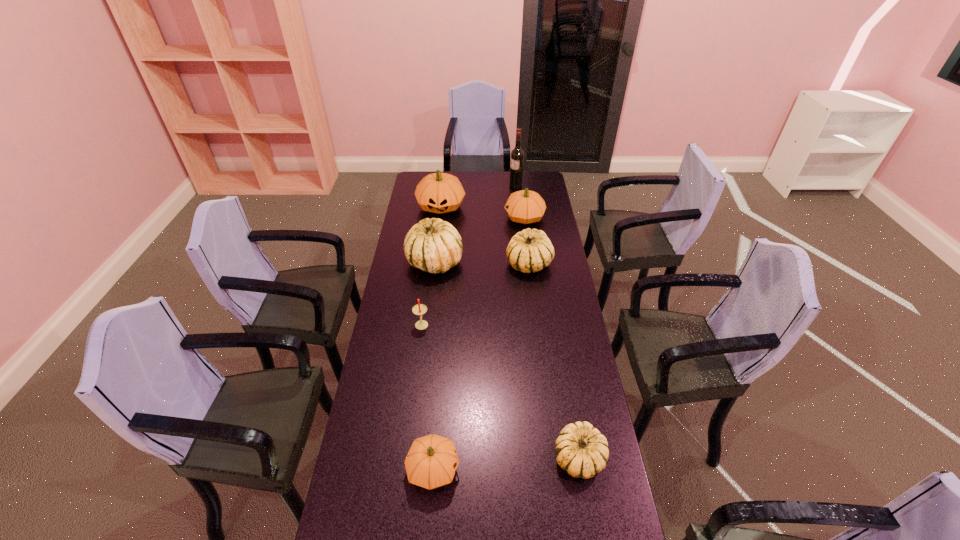
Locate an element on the screen. The height and width of the screenshot is (540, 960). free space located 0.060m on the back of the nearest white gourd is located at coordinates (572, 416).

The image size is (960, 540). Identify the location of object located in the far edge section of the desktop. (517, 154).

Find the location of a particular element. Image resolution: width=960 pixels, height=540 pixels. candle that is at the left edge is located at coordinates (419, 309).

Locate an element on the screen. wine bottle that is at the right edge is located at coordinates (517, 154).

At what (x,y) coordinates should I click in order to perform the action: click on object positioned at the far right corner. Please return your answer as a coordinate pair (x, y). Looking at the image, I should click on (517, 154).

Image resolution: width=960 pixels, height=540 pixels. Find the location of `free space at the left edge`. free space at the left edge is located at coordinates (417, 220).

In the image, there is a desktop. At what (x,y) coordinates should I click in order to perform the action: click on free space at the right edge. Please return your answer as a coordinate pair (x, y). Looking at the image, I should click on (530, 223).

The image size is (960, 540). In order to click on vacant area at the far right corner in this screenshot , I will do `click(541, 172)`.

This screenshot has width=960, height=540. Identify the location of blank region between the leftmost white gourd and the tallest object. (475, 224).

Find the location of a particular element. The image size is (960, 540). vacant space that's between the second biggest white gourd and the smallest white gourd is located at coordinates (554, 361).